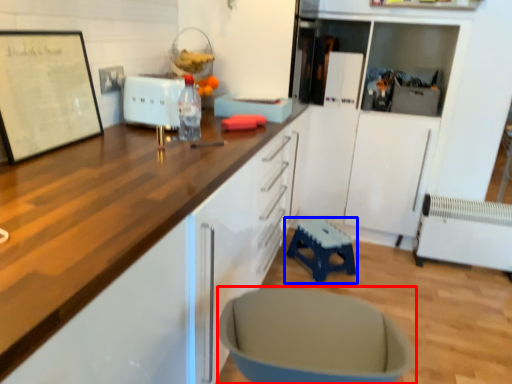
Question: Which of the following is the farthest to the observer, swivel chair (highlighted by a red box) or furniture (highlighted by a blue box)?

Choices:
 (A) swivel chair
 (B) furniture

Answer: (B)